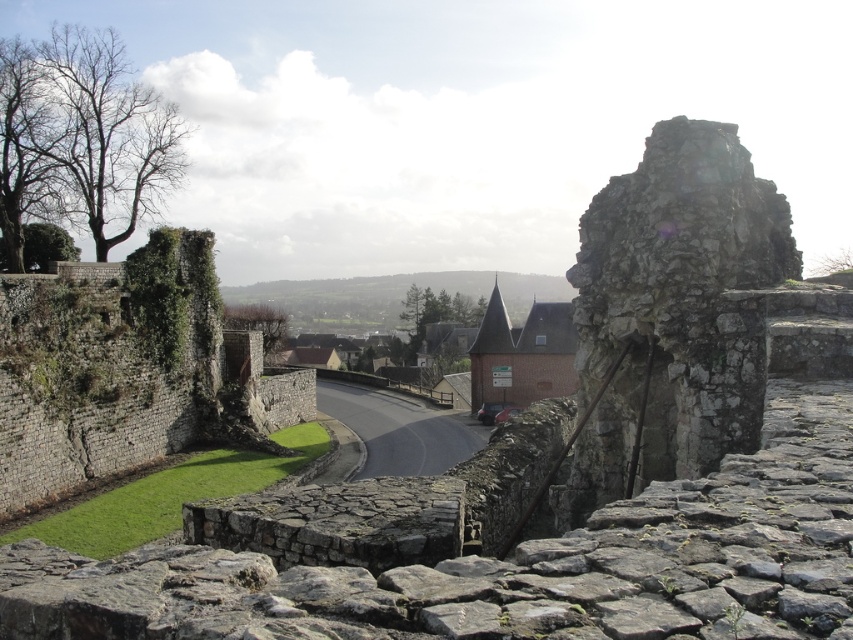
In the scene shown: You are a tour guide leading a group along the paved road. You want to point out the green mossy stone wall at left and the brick tower at center to your visitors. How far apart are these two landmarks?

The green mossy stone wall at left and the brick tower at center are 40.07 meters apart.

You are a painter wanting to capture the scene. You notice the green mossy stone wall at left and the brick tower at center. Which object should you focus on if you want to paint the wider structure?

The brick tower at center is wider than the green mossy stone wall at left, so you should focus on the brick tower at center.